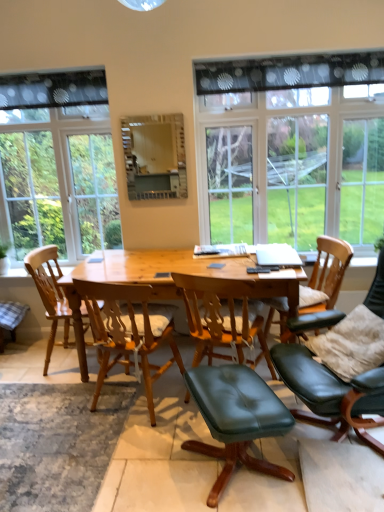
The width and height of the screenshot is (384, 512). Find the location of `vacant space underneath green leather stool at lower center (from a real-world perspective)`. vacant space underneath green leather stool at lower center (from a real-world perspective) is located at coordinates (225, 473).